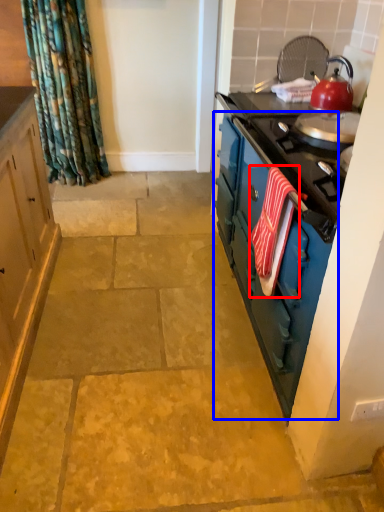
Question: Which object appears farthest to the camera in this image, beach towel (highlighted by a red box) or dresser (highlighted by a blue box)?

Choices:
 (A) beach towel
 (B) dresser

Answer: (A)